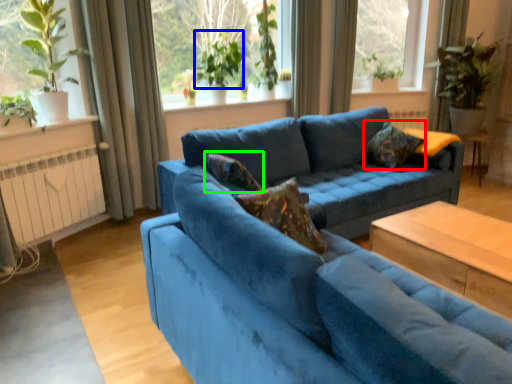
Question: Which object is the closest to the pillow (highlighted by a red box)? Choose among these: plant (highlighted by a blue box) or pillow (highlighted by a green box).

Choices:
 (A) plant
 (B) pillow

Answer: (B)